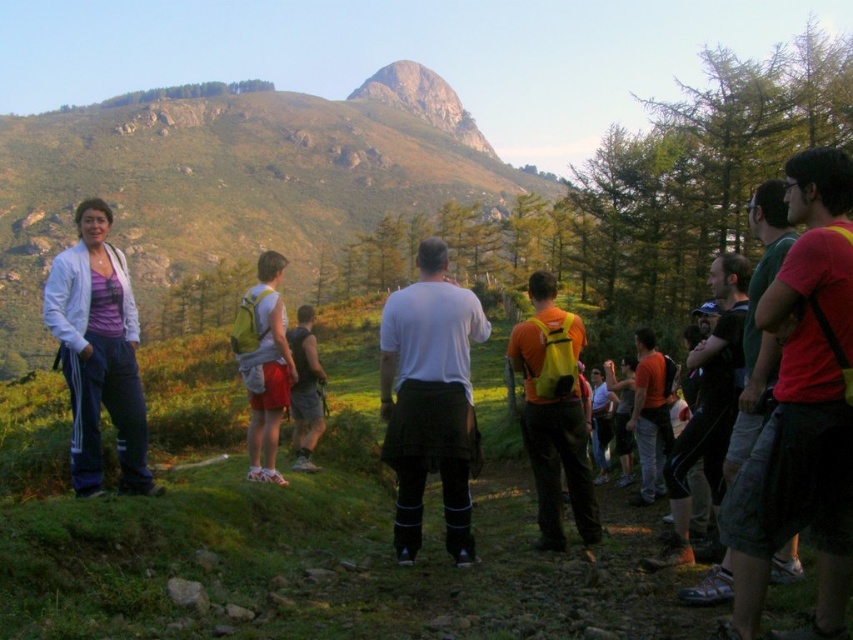
In the scene shown: You are a photographer standing at the base of the green grassy hillside at upper left and want to take a photo of the yellow fabric backpack at center. Which object is closer to you, the photographer, so that you can focus on the backpack?

The yellow fabric backpack at center is closer to you than the green grassy hillside at upper left, so you can focus on the backpack.

You are a hiker trying to locate your yellow fabric backpack at center. You are currently standing on the green grassy hillside at upper left. In which direction should you move to reach your backpack?

The green grassy hillside at upper left is to the left of the yellow fabric backpack at center, so you should move to the right to reach your backpack.